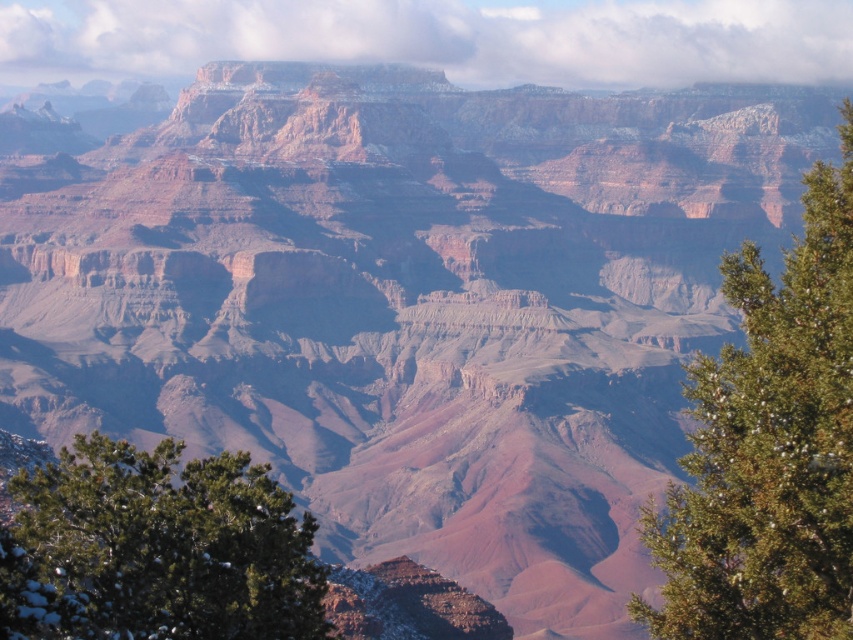
Is green textured pine tree at right positioned at the back of green textured pine tree at lower left?

No, it is in front of green textured pine tree at lower left.

Can you confirm if green textured pine tree at right is thinner than green textured pine tree at lower left?

No.

Does point (764, 388) lie behind point (306, 564)?

No.

The height and width of the screenshot is (640, 853). I want to click on green textured pine tree at right, so click(x=769, y=445).